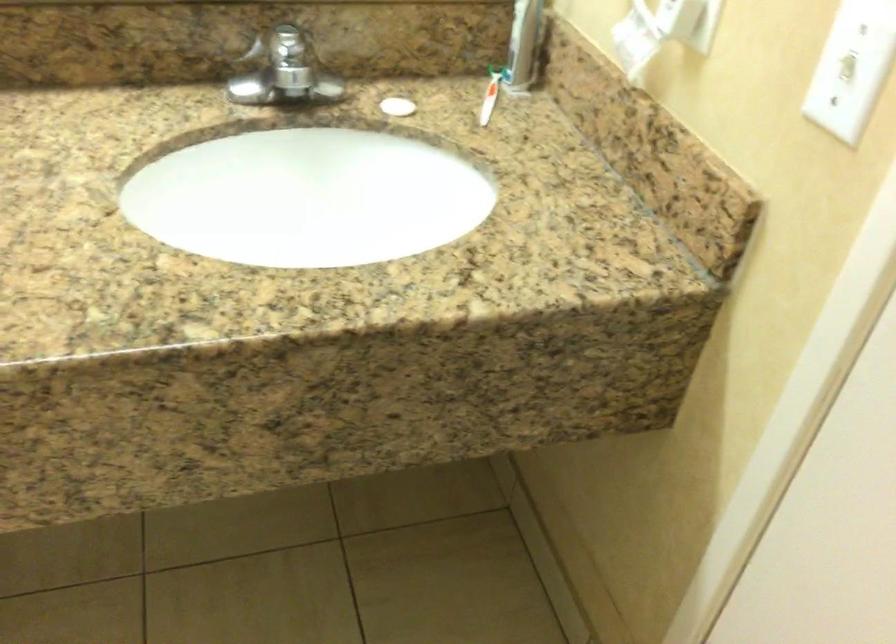
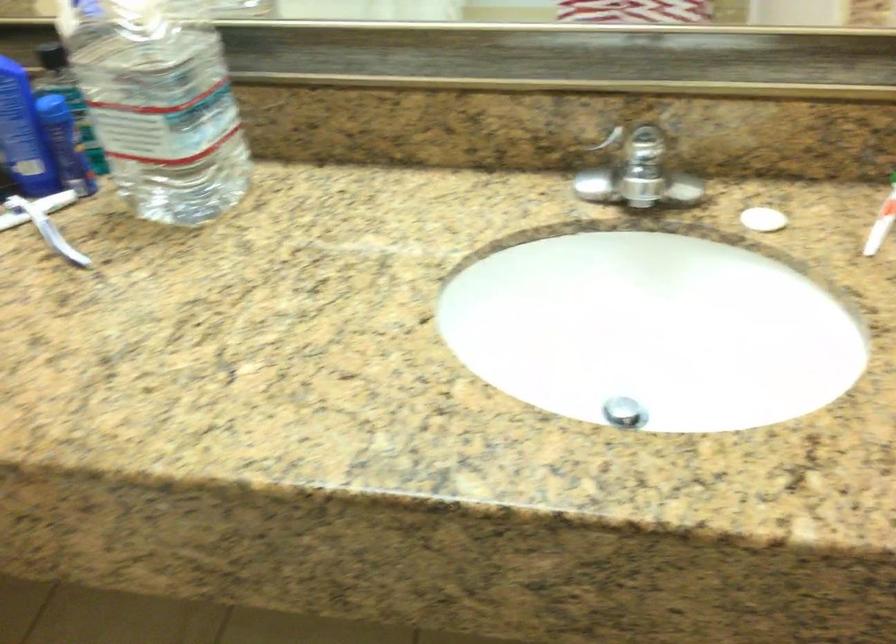
Locate, in the second image, the point that corresponds to pixel 489 104 in the first image.

(881, 222)